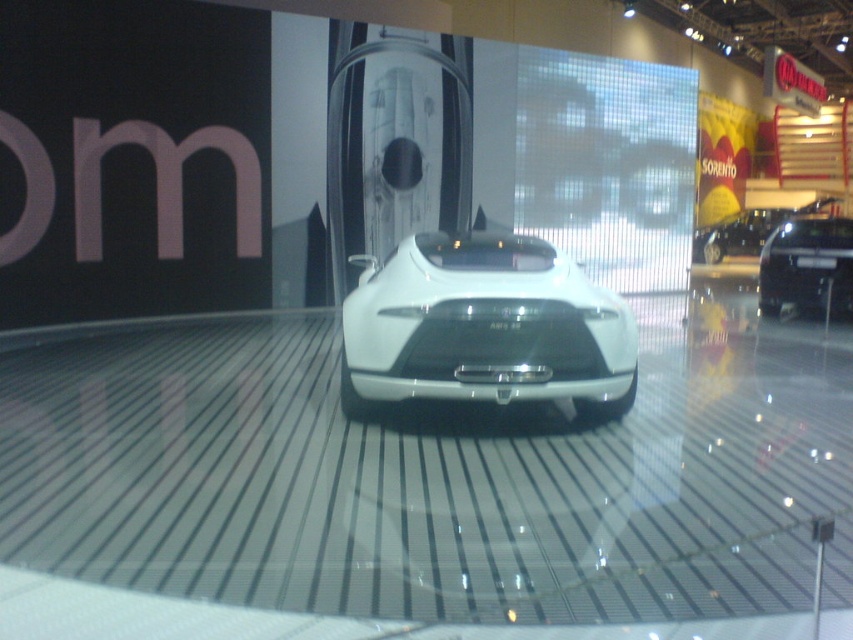
Consider the image. You are a photographer standing at a certain distance from the black glossy car at center. You need to capture a full shot of the car without any distortion. The ideal distance for this is 12 meters. Do you need to move closer or farther away?

The distance between the black glossy car at center and the camera is 10.91 meters. Since the ideal distance is 12 meters, you need to move 1.09 meters farther away to achieve the desired shot without distortion.

You are a photographer at the auto show and need to position your camera exactly at the center of the white glossy sports car at center. What are the coordinates you should aim for?

The coordinates to aim for are 0.512 in the x direction and 0.570 in the y direction, as the white glossy sports car at center is located at point [485,326].